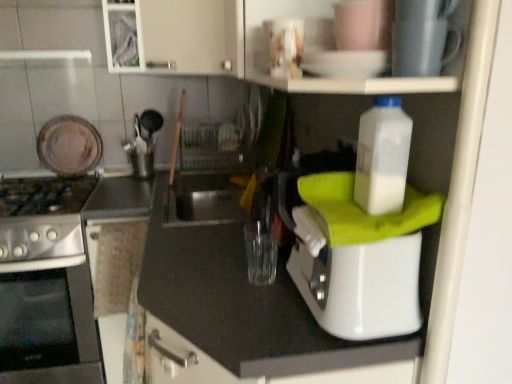
Question: Is stainless steel oven at left outside of white plastic bottle at upper right?

Choices:
 (A) no
 (B) yes

Answer: (B)

Question: Does stainless steel oven at left lie behind white plastic bottle at upper right?

Choices:
 (A) no
 (B) yes

Answer: (B)

Question: Is white plastic bottle at upper right surrounded by stainless steel oven at left?

Choices:
 (A) yes
 (B) no

Answer: (B)

Question: Is stainless steel oven at left wider than white plastic bottle at upper right?

Choices:
 (A) no
 (B) yes

Answer: (B)

Question: Is stainless steel oven at left far away from white plastic bottle at upper right?

Choices:
 (A) yes
 (B) no

Answer: (A)

Question: From the image's perspective, is stainless steel oven at left under white plastic bottle at upper right?

Choices:
 (A) no
 (B) yes

Answer: (B)

Question: From the image's perspective, is matte brown plate at upper left, the second appliance when ordered from right to left, beneath satin silver gas stove at left?

Choices:
 (A) yes
 (B) no

Answer: (B)

Question: Is matte brown plate at upper left, which is the 1th appliance from back to front, thinner than satin silver gas stove at left?

Choices:
 (A) no
 (B) yes

Answer: (B)

Question: Does matte brown plate at upper left, the second appliance when ordered from right to left, appear on the left side of satin silver gas stove at left?

Choices:
 (A) yes
 (B) no

Answer: (B)

Question: Would you say matte brown plate at upper left, acting as the second appliance starting from the front, contains satin silver gas stove at left?

Choices:
 (A) yes
 (B) no

Answer: (B)

Question: Is matte brown plate at upper left, the second appliance when ordered from right to left, positioned far away from satin silver gas stove at left?

Choices:
 (A) no
 (B) yes

Answer: (A)

Question: From the image's perspective, is matte brown plate at upper left, the second appliance when ordered from right to left, on top of satin silver gas stove at left?

Choices:
 (A) no
 (B) yes

Answer: (B)

Question: From the image's perspective, does stainless steel oven at left appear lower than metallic silver cup at upper center, positioned as the second appliance in back-to-front order?

Choices:
 (A) no
 (B) yes

Answer: (B)